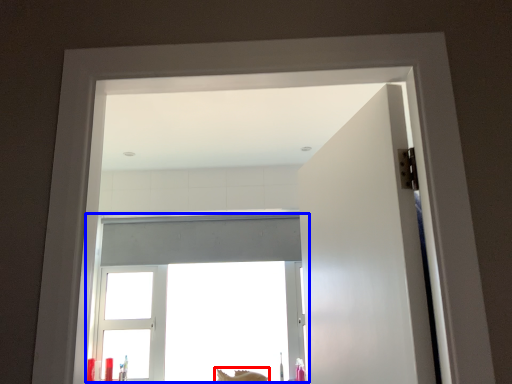
Question: Which object appears farthest to the camera in this image, animal (highlighted by a red box) or window (highlighted by a blue box)?

Choices:
 (A) animal
 (B) window

Answer: (B)